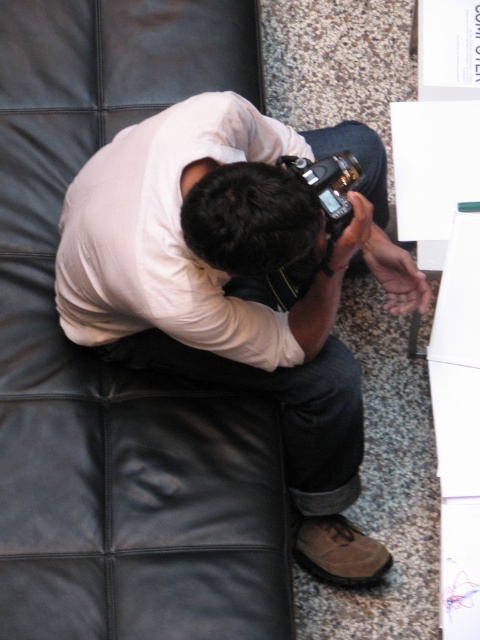
Can you confirm if black leather couch at upper left is taller than white matte shirt at center?

Correct, black leather couch at upper left is much taller as white matte shirt at center.

Based on the photo, can you confirm if black leather couch at upper left is positioned above white matte shirt at center?

Indeed, black leather couch at upper left is positioned over white matte shirt at center.

Locate an element on the screen. The image size is (480, 640). black leather couch at upper left is located at coordinates (120, 368).